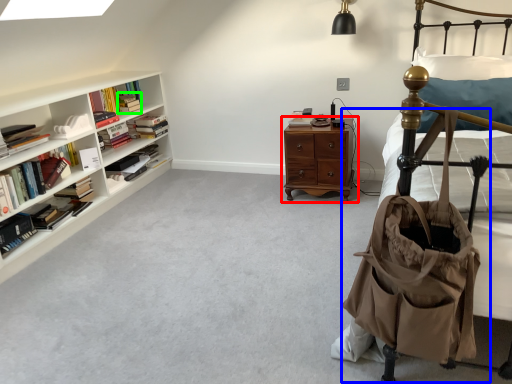
Question: Based on their relative distances, which object is farther from nightstand (highlighted by a red box)? Choose from baby carriage (highlighted by a blue box) and book (highlighted by a green box).

Choices:
 (A) baby carriage
 (B) book

Answer: (A)